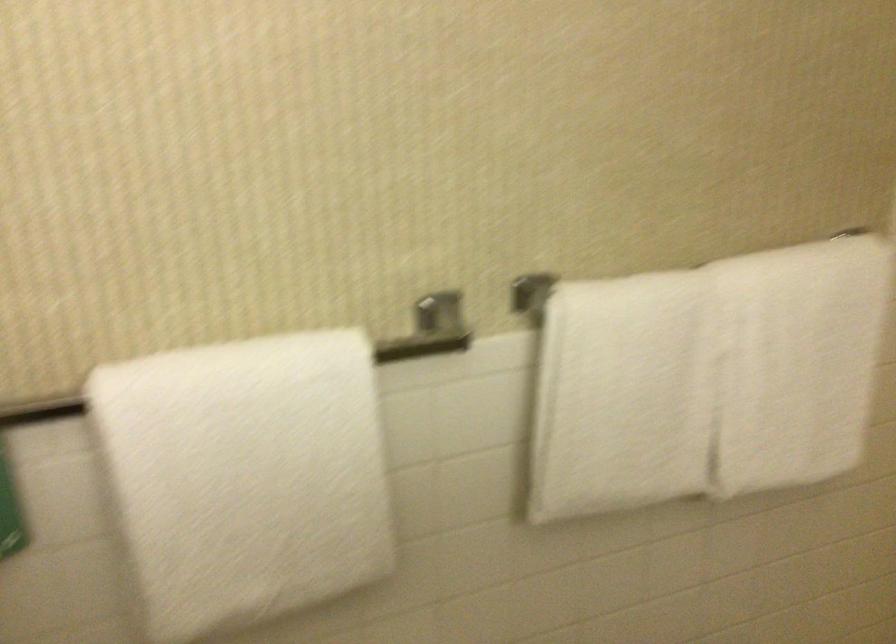
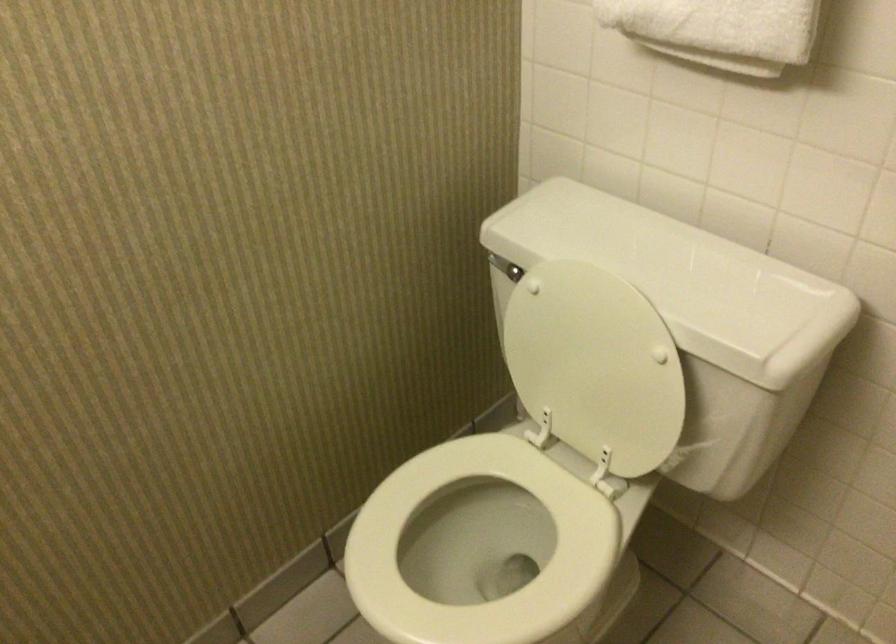
The images are taken continuously from a first-person perspective. In which direction is your viewpoint rotating?

The rotation direction of the camera is left-down.